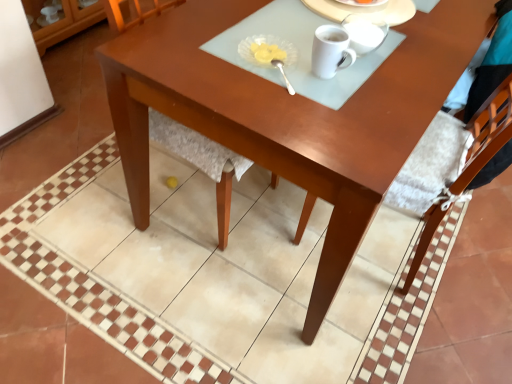
Where is `space that is in front of translucent glass dish at upper center, positioned as the third tableware in top-to-bottom order`? This screenshot has height=384, width=512. space that is in front of translucent glass dish at upper center, positioned as the third tableware in top-to-bottom order is located at coordinates 253,88.